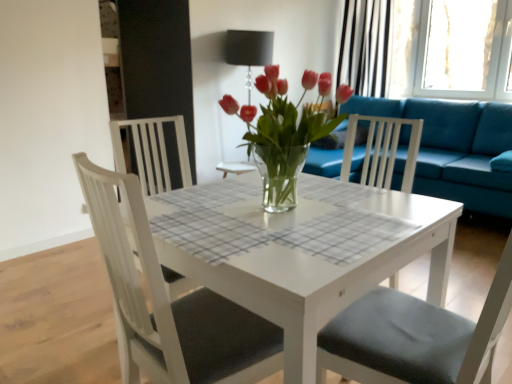
Measure the distance between matte black lampshade at center and camera.

A distance of 3.54 meters exists between matte black lampshade at center and camera.

The width and height of the screenshot is (512, 384). What do you see at coordinates (282, 133) in the screenshot? I see `clear glass vase at center` at bounding box center [282, 133].

Identify the location of white matte chair at center, which is the first chair from right to left. This screenshot has height=384, width=512. (415, 337).

Describe the element at coordinates (300, 260) in the screenshot. I see `white glossy table at center` at that location.

This screenshot has height=384, width=512. What do you see at coordinates (365, 46) in the screenshot?
I see `black striped curtain at upper right` at bounding box center [365, 46].

Where is `white matte chair at center, the 2th chair when ordered from right to left`? white matte chair at center, the 2th chair when ordered from right to left is located at coordinates (170, 302).

From the image's perspective, between white glossy table at center and white matte chair at center, which is the first chair from right to left, who is located below?

white glossy table at center appears lower in the image.

From a real-world perspective, which is physically above, white glossy table at center or white matte chair at center, the second chair from the left?

In real-world perspective, white matte chair at center, the second chair from the left, is above.

Is white glossy table at center far away from white matte chair at center, which is the first chair from right to left?

white glossy table at center is near white matte chair at center, which is the first chair from right to left, not far away.

Is white glossy table at center bigger than white matte chair at center, the second chair from the left?

Yes, white glossy table at center is bigger than white matte chair at center, the second chair from the left.

Would you say teal fabric couch at right is part of white matte chair at center, the second chair from the left,'s contents?

No.

Does point (481, 347) come farther from viewer compared to point (464, 173)?

No, it is not.

From a real-world perspective, is white matte chair at center, the second chair from the left, positioned over teal fabric couch at right based on gravity?

Indeed, from a real-world perspective, white matte chair at center, the second chair from the left, stands above teal fabric couch at right.

From the image's perspective, between white matte chair at center, which is the first chair from right to left, and teal fabric couch at right, who is located below?

white matte chair at center, which is the first chair from right to left, is shown below in the image.

Can you tell me how much white matte chair at center, which is the first chair from right to left, and clear glass vase at center differ in facing direction?

white matte chair at center, which is the first chair from right to left, and clear glass vase at center are facing 93.8 degrees away from each other.

Is white matte chair at center, the second chair from the left, thinner than clear glass vase at center?

Incorrect, the width of white matte chair at center, the second chair from the left, is not less than that of clear glass vase at center.

You are a GUI agent. You are given a task and a screenshot of the screen. Output one action in this format:
    pyautogui.click(x=<x>, y=<y>)
    Task: Click on the houseplant on the left of white matte chair at center, the second chair from the left
    The image size is (512, 384).
    Given the screenshot: What is the action you would take?
    pyautogui.click(x=282, y=133)

From the image's perspective, would you say black striped curtain at upper right is shown under transparent glass window at upper right?

Actually, black striped curtain at upper right appears above transparent glass window at upper right in the image.

Is transparent glass window at upper right inside black striped curtain at upper right?

Definitely not — transparent glass window at upper right is not inside black striped curtain at upper right.

How many degrees apart are the facing directions of black striped curtain at upper right and transparent glass window at upper right?

The angular difference between black striped curtain at upper right and transparent glass window at upper right is 0.000195 degrees.

Is black striped curtain at upper right positioned with its back to transparent glass window at upper right?

black striped curtain at upper right does not have its back to transparent glass window at upper right.

Considering the points (369, 0) and (253, 49), which point is behind, point (369, 0) or point (253, 49)?

The point (369, 0) is farther.

Image resolution: width=512 pixels, height=384 pixels. In order to click on curtain lying above the matte black lampshade at center (from the image's perspective) in this screenshot , I will do `click(365, 46)`.

How many degrees apart are the facing directions of black striped curtain at upper right and matte black lampshade at center?

There is a 90.4-degree angle between the facing directions of black striped curtain at upper right and matte black lampshade at center.

From the picture: In the image, is black striped curtain at upper right on the left side or the right side of matte black lampshade at center?

black striped curtain at upper right is positioned on matte black lampshade at center's right side.

Is white glossy table at center aimed at clear glass vase at center?

No, white glossy table at center is not turned towards clear glass vase at center.

Is white glossy table at center outside of clear glass vase at center?

Yes, white glossy table at center is located beyond the bounds of clear glass vase at center.

Is white glossy table at center thinner than clear glass vase at center?

No.

Considering the sizes of white glossy table at center and clear glass vase at center in the image, is white glossy table at center bigger or smaller than clear glass vase at center?

white glossy table at center is bigger than clear glass vase at center.

Would you say teal fabric couch at right is inside or outside clear glass vase at center?

teal fabric couch at right exists outside the volume of clear glass vase at center.

Who is taller, teal fabric couch at right or clear glass vase at center?

teal fabric couch at right.

Between teal fabric couch at right and clear glass vase at center, which one has larger width?

teal fabric couch at right is wider.

Where is `studio couch that is under the clear glass vase at center (from a real-world perspective)`? studio couch that is under the clear glass vase at center (from a real-world perspective) is located at coordinates (454, 148).

Locate an element on the screen. Image resolution: width=512 pixels, height=384 pixels. round table below the white matte chair at center, which is the first chair from right to left (from the image's perspective) is located at coordinates (300, 260).

You are a GUI agent. You are given a task and a screenshot of the screen. Output one action in this format:
    pyautogui.click(x=<x>, y=<y>)
    Task: Click on the chair that is the 1st object to the left of the teal fabric couch at right, starting at the anchor
    
    Given the screenshot: What is the action you would take?
    pyautogui.click(x=415, y=337)

Based on the photo, which object lies nearer to the anchor point matte black lampshade at center, white matte chair at center, the 1th chair viewed from the left, or white matte chair at center, the second chair from the left?

The object closer to matte black lampshade at center is white matte chair at center, the 1th chair viewed from the left.

From the image, which object appears to be farther from clear glass vase at center, black striped curtain at upper right or white matte chair at center, the 1th chair viewed from the left?

black striped curtain at upper right is further to clear glass vase at center.

From the image, which object appears to be farther from clear glass vase at center, white matte chair at center, which is the first chair from right to left, or matte black lampshade at center?

Based on the image, matte black lampshade at center appears to be further to clear glass vase at center.

Considering their positions, is white matte chair at center, the 1th chair viewed from the left, positioned further to white matte chair at center, the second chair from the left, than matte black lampshade at center?

matte black lampshade at center.

Looking at the image, which one is located closer to black striped curtain at upper right, teal fabric couch at right or transparent glass window at upper right?

transparent glass window at upper right.

Estimate the real-world distances between objects in this image. Which object is closer to black striped curtain at upper right, white matte chair at center, the second chair from the left, or matte black lampshade at center?

Among the two, matte black lampshade at center is located nearer to black striped curtain at upper right.

From the image, which object appears to be farther from white glossy table at center, clear glass vase at center or white matte chair at center, the 1th chair viewed from the left?

clear glass vase at center is further to white glossy table at center.

From the image, which object appears to be farther from matte black lampshade at center, teal fabric couch at right or white matte chair at center, the second chair from the left?

white matte chair at center, the second chair from the left, is positioned further to the anchor matte black lampshade at center.

Where is `chair between white matte chair at center, the second chair from the left, and transparent glass window at upper right from front to back`? Image resolution: width=512 pixels, height=384 pixels. chair between white matte chair at center, the second chair from the left, and transparent glass window at upper right from front to back is located at coordinates (170, 302).

You are a GUI agent. You are given a task and a screenshot of the screen. Output one action in this format:
    pyautogui.click(x=<x>, y=<y>)
    Task: Click on the round table located between white matte chair at center, the 2th chair when ordered from right to left, and teal fabric couch at right in the depth direction
    
    Given the screenshot: What is the action you would take?
    pyautogui.click(x=300, y=260)

I want to click on houseplant between white matte chair at center, the 1th chair viewed from the left, and transparent glass window at upper right in the front-back direction, so click(x=282, y=133).

This screenshot has width=512, height=384. I want to click on studio couch positioned between white matte chair at center, which is the first chair from right to left, and transparent glass window at upper right from near to far, so click(x=454, y=148).